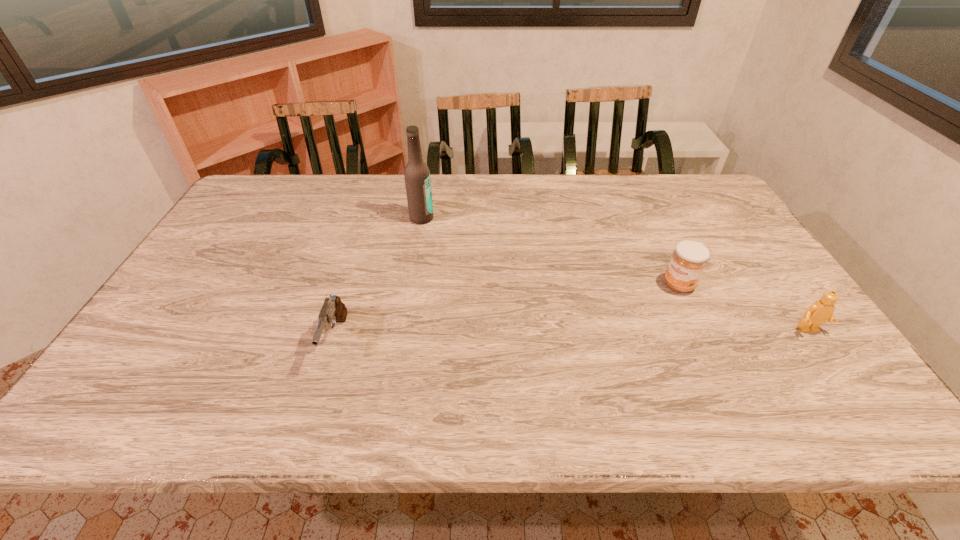
This screenshot has height=540, width=960. I want to click on free spot on the desktop that is between the pistol and the Lego and is positioned on the front label of the third nearest object, so click(x=623, y=334).

The width and height of the screenshot is (960, 540). What are the coordinates of `free space on the desktop that is between the pistol and the Lego and is positioned on the label of the second object from left to right` in the screenshot? It's located at (601, 334).